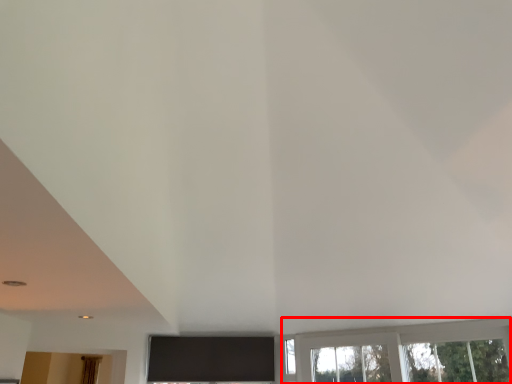
Question: From the image's perspective, considering the relative positions of window (annotated by the red box) and curtain in the image provided, where is window (annotated by the red box) located with respect to the staircase?

Choices:
 (A) below
 (B) above

Answer: (B)